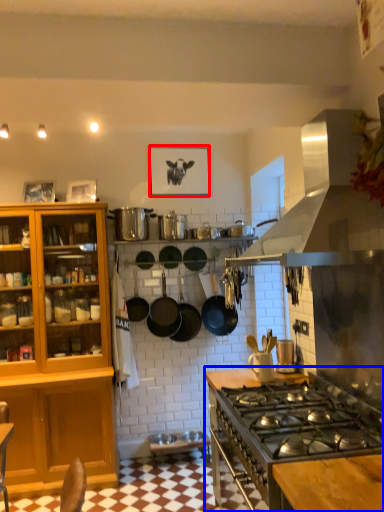
Question: Which point is closer to the camera, picture frame (highlighted by a red box) or countertop (highlighted by a blue box)?

Choices:
 (A) picture frame
 (B) countertop

Answer: (B)